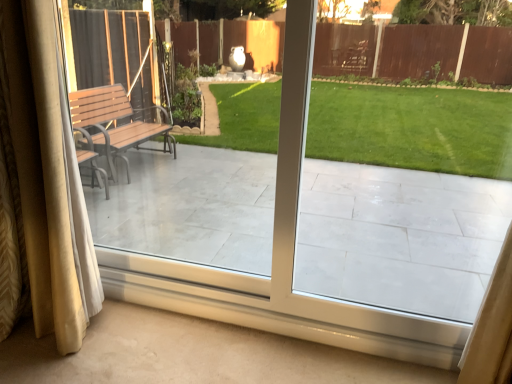
Question: Considering the relative sizes of white tile porch at center and silky beige curtains at left in the image provided, is white tile porch at center thinner than silky beige curtains at left?

Choices:
 (A) yes
 (B) no

Answer: (A)

Question: Can you confirm if white tile porch at center is shorter than silky beige curtains at left?

Choices:
 (A) yes
 (B) no

Answer: (A)

Question: Can you see white tile porch at center touching silky beige curtains at left?

Choices:
 (A) no
 (B) yes

Answer: (A)

Question: From a real-world perspective, is white tile porch at center positioned under silky beige curtains at left based on gravity?

Choices:
 (A) yes
 (B) no

Answer: (B)

Question: Could you tell me if white tile porch at center is turned towards silky beige curtains at left?

Choices:
 (A) no
 (B) yes

Answer: (A)

Question: Does white tile porch at center have a greater width compared to silky beige curtains at left?

Choices:
 (A) yes
 (B) no

Answer: (B)

Question: Considering the relative positions of silky beige curtains at left and white tile porch at center in the image provided, is silky beige curtains at left to the left of white tile porch at center from the viewer's perspective?

Choices:
 (A) yes
 (B) no

Answer: (A)

Question: Can you confirm if silky beige curtains at left is positioned to the right of white tile porch at center?

Choices:
 (A) no
 (B) yes

Answer: (A)

Question: Does silky beige curtains at left have a greater width compared to white tile porch at center?

Choices:
 (A) yes
 (B) no

Answer: (A)

Question: Is silky beige curtains at left not within white tile porch at center?

Choices:
 (A) no
 (B) yes

Answer: (B)

Question: Does silky beige curtains at left have a smaller size compared to white tile porch at center?

Choices:
 (A) yes
 (B) no

Answer: (B)

Question: Is silky beige curtains at left positioned behind white tile porch at center?

Choices:
 (A) no
 (B) yes

Answer: (B)

Question: Is silky beige curtains at left situated inside white tile porch at center or outside?

Choices:
 (A) inside
 (B) outside

Answer: (B)